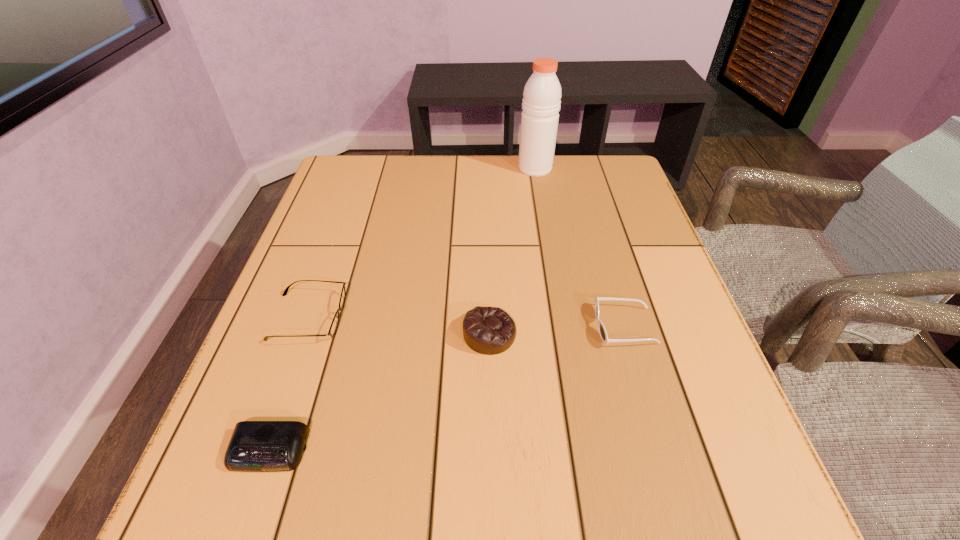
The image size is (960, 540). Find the location of `shaker`. shaker is located at coordinates (541, 100).

Locate an element on the screen. The width and height of the screenshot is (960, 540). the farthest object is located at coordinates (541, 100).

Identify the location of beanbag. (486, 330).

Where is `the second tallest object`? the second tallest object is located at coordinates (486, 330).

Image resolution: width=960 pixels, height=540 pixels. Find the location of `sunglasses`. sunglasses is located at coordinates (602, 331).

This screenshot has height=540, width=960. Identify the location of spectacles. (335, 322).

Locate an element on the screen. alarm clock is located at coordinates [x=255, y=446].

Where is `free spot located 0.210m on the front of the shaker`? The image size is (960, 540). free spot located 0.210m on the front of the shaker is located at coordinates (544, 224).

Where is `vacant space located 0.130m on the back of the second tallest object`? This screenshot has width=960, height=540. vacant space located 0.130m on the back of the second tallest object is located at coordinates (489, 269).

Find the location of a particular element. Image resolution: width=960 pixels, height=540 pixels. free point located 0.210m with the lenses of the sunglasses facing outward is located at coordinates (489, 326).